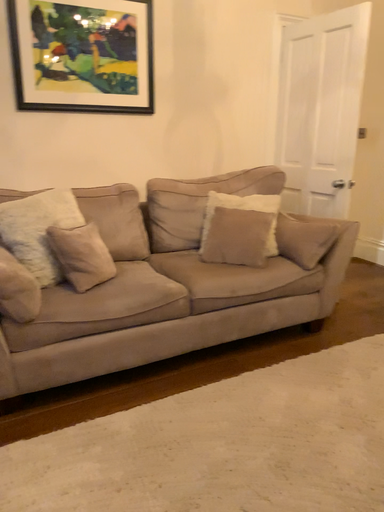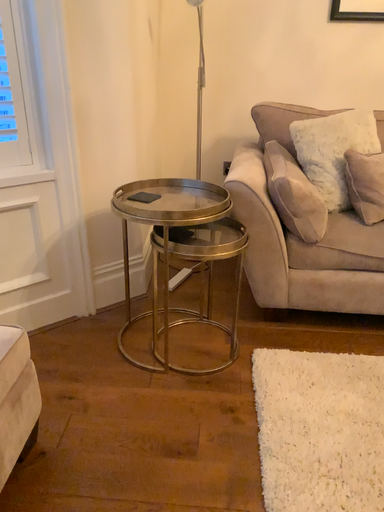
Question: How did the camera likely rotate when shooting the video?

Choices:
 (A) rotated upward
 (B) rotated downward

Answer: (B)